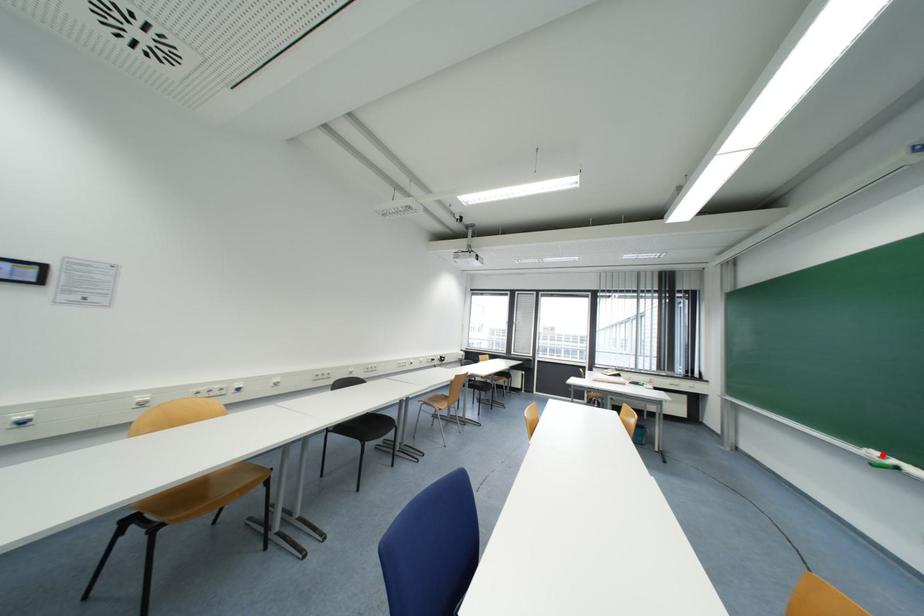
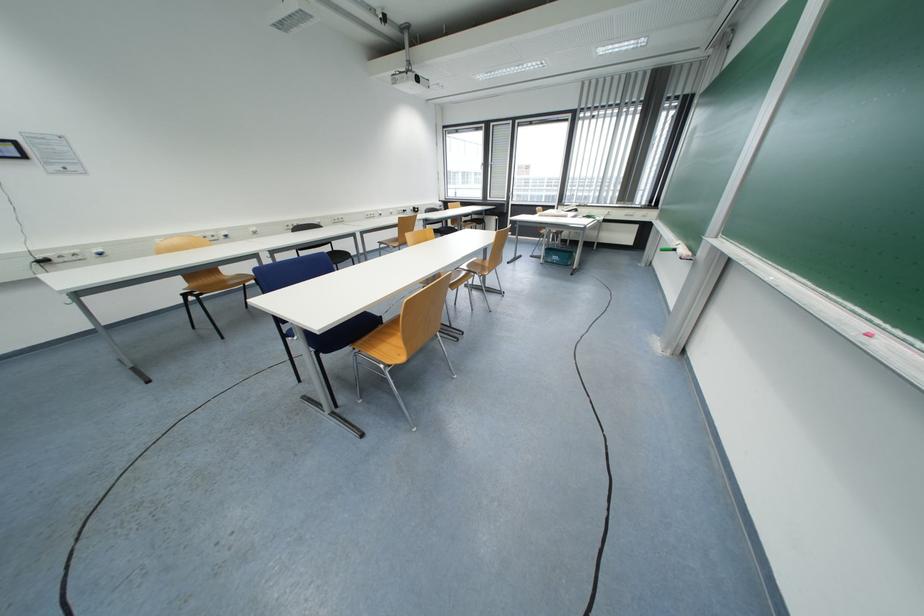
Where in the second image is the point corresponding to the highlighted location from the first image?

(683, 244)